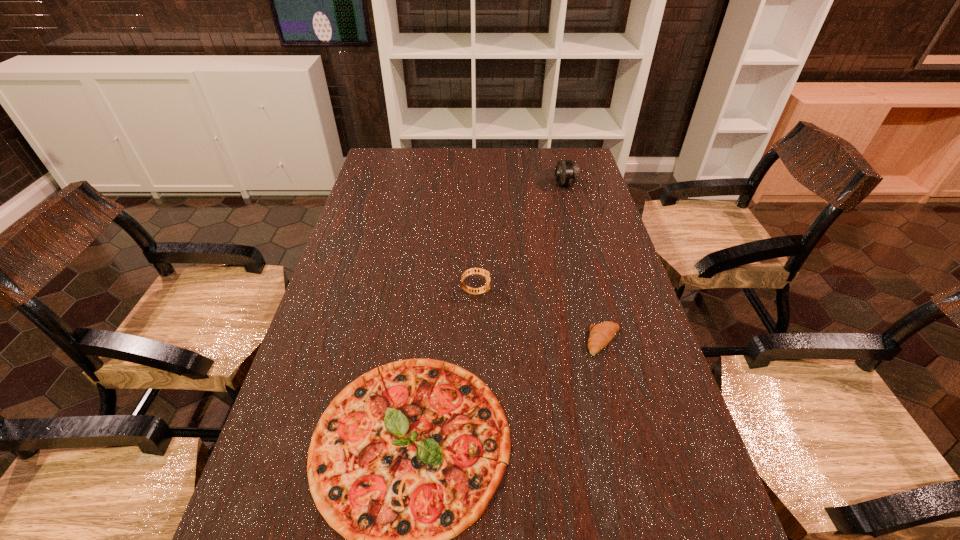
At what (x,y) coordinates should I click in order to perform the action: click on vacant area that satisfies the following two spatial constraints: 1. on the back side of the second nearest object; 2. on the face of the third shortest object. Please return your answer as a coordinate pair (x, y). The width and height of the screenshot is (960, 540). Looking at the image, I should click on (591, 292).